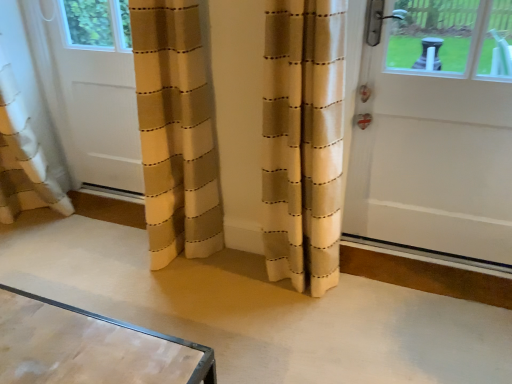
Where is `free space in front of white glossy door at right, marked as the first door in a right-to-left arrangement`? free space in front of white glossy door at right, marked as the first door in a right-to-left arrangement is located at coordinates (426, 331).